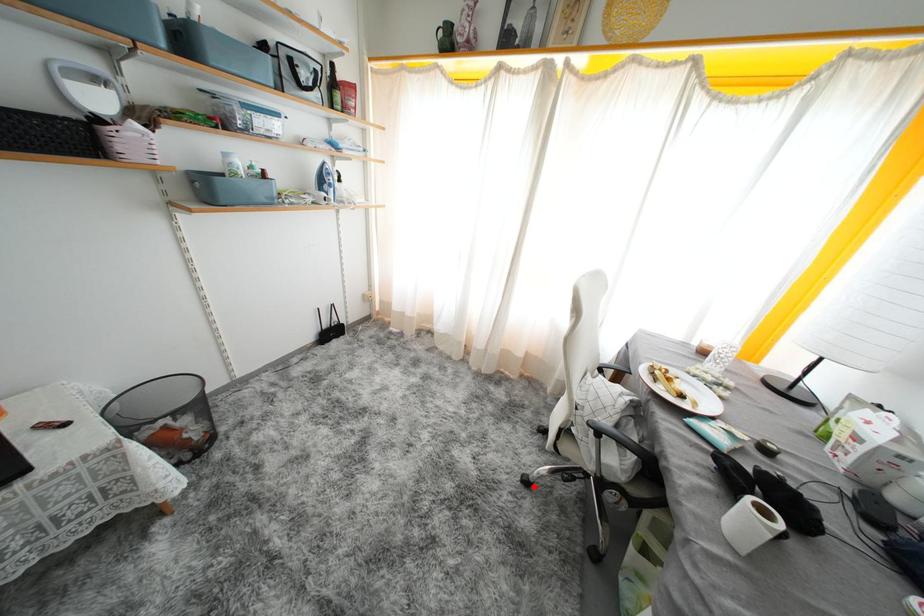
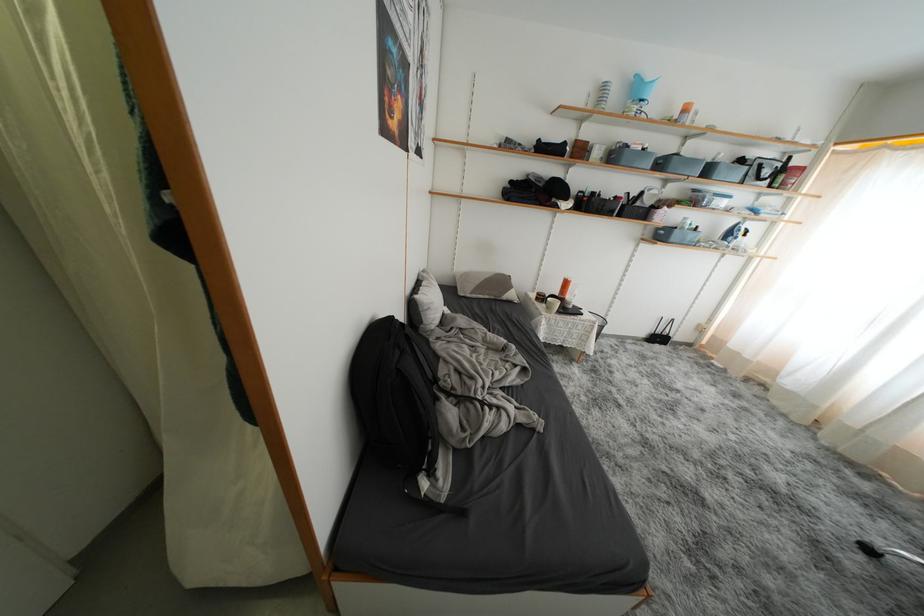
Question: I am providing you with two images of the same scene from different viewpoints. Image1 has a red point marked. In image2, the corresponding 3D location appears at what relative position? Reply with the corresponding letter.

Choices:
 (A) Closer
 (B) Farther

Answer: (B)